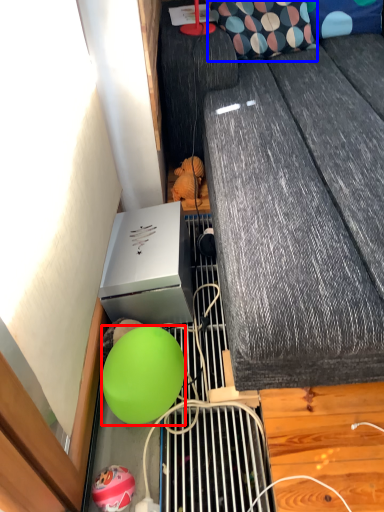
Question: Which of the following is the farthest to the observer, ball (highlighted by a red box) or pillow (highlighted by a blue box)?

Choices:
 (A) ball
 (B) pillow

Answer: (B)